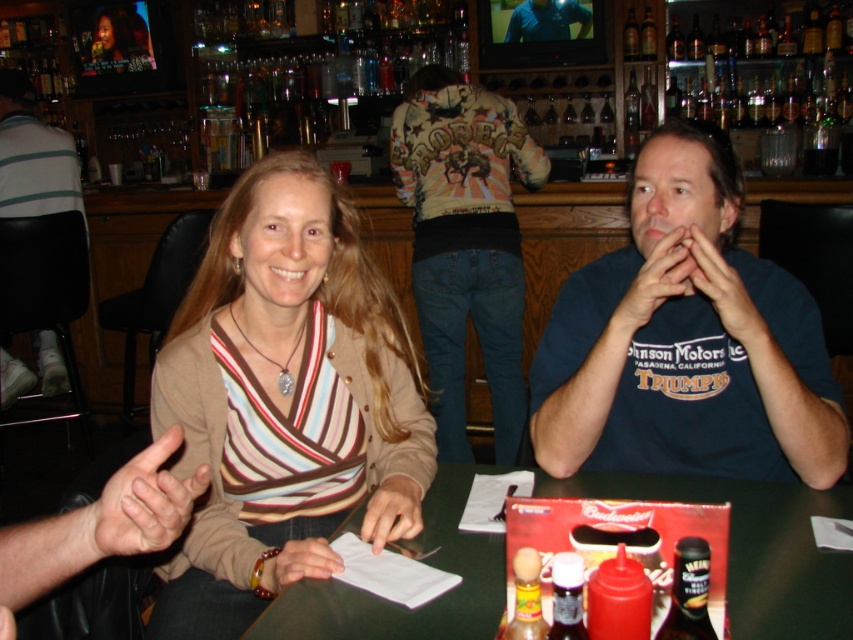
You are standing in the bar and want to walk from point A to point B. Point A is at coordinate point(538,35) and point B is at coordinate point(328,554). Which point is closer to you?

Point A at coordinate point(538,35) is closer to you than point B at coordinate point(328,554) because it is further to the viewer.

You are a fashion designer observing a couple at a table in a bar. You notice the striped knit sweater at center and the blue cotton shirt at center. Which clothing item would require more fabric to produce?

The striped knit sweater at center is bigger than the blue cotton shirt at center, so it would require more fabric to produce.